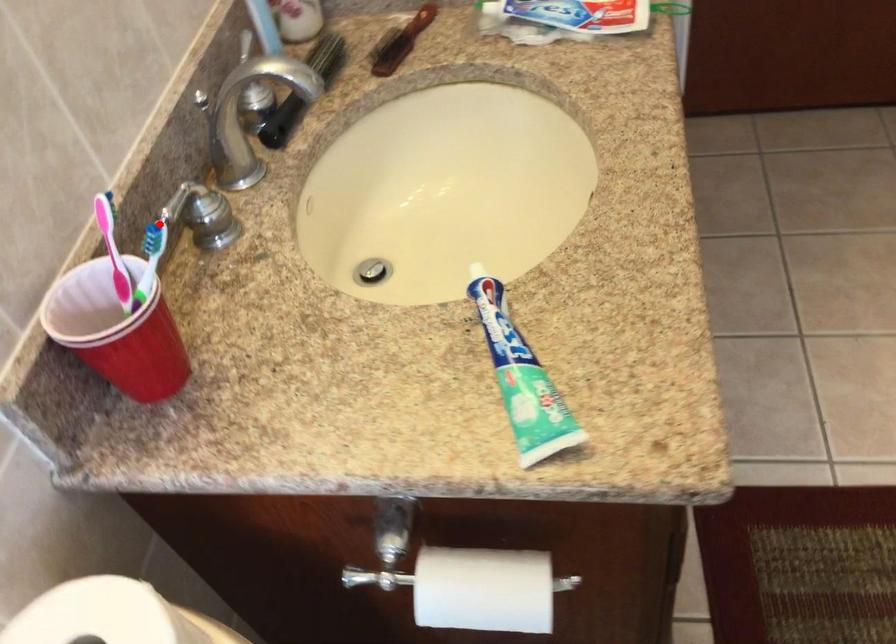
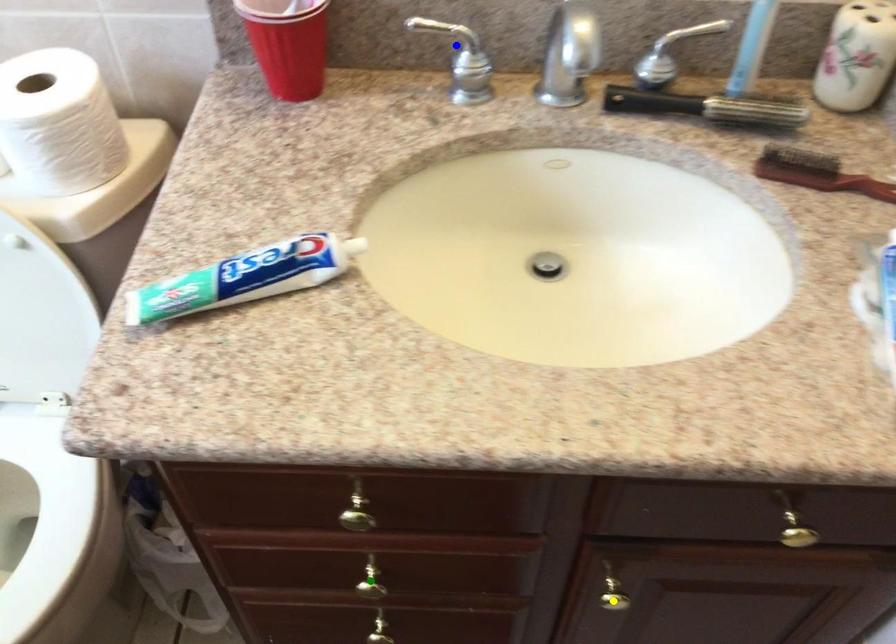
Question: I am providing you with two images of the same scene from different viewpoints. A red point is marked on the first image. You are given multiple points on the second image. Which spot in image 2 lines up with the point in image 1?

Choices:
 (A) blue point
 (B) green point
 (C) yellow point

Answer: (A)